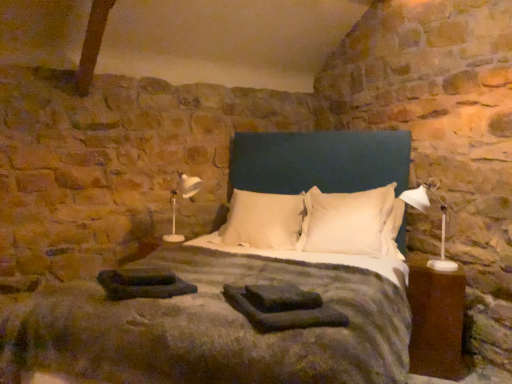
This screenshot has height=384, width=512. Identify the location of white soft pillow at center, which is counted as the 1th pillow, starting from the right. (352, 222).

The image size is (512, 384). Find the location of `brown wood nightstand at right`. brown wood nightstand at right is located at coordinates (436, 320).

The image size is (512, 384). Describe the element at coordinates (262, 221) in the screenshot. I see `white soft pillow at center, which is the second pillow from right to left` at that location.

What do you see at coordinates (240, 310) in the screenshot? This screenshot has width=512, height=384. I see `velvet blue bed at center` at bounding box center [240, 310].

From the picture: What is the approximate width of white plastic table lamp at left, which appears as the second table lamp when viewed from the right?

white plastic table lamp at left, which appears as the second table lamp when viewed from the right, is 54.87 centimeters in width.

In order to click on white plastic table lamp at right, the second table lamp when ordered from left to right in this screenshot , I will do `click(425, 212)`.

This screenshot has height=384, width=512. What do you see at coordinates (425, 212) in the screenshot? I see `white plastic table lamp at right, the second table lamp when ordered from left to right` at bounding box center [425, 212].

At what (x,y) coordinates should I click in order to perform the action: click on black fabric at lower left, the 1th material when ordered from left to right. Please return your answer as a coordinate pair (x, y). This screenshot has width=512, height=384. Looking at the image, I should click on click(x=143, y=284).

Find the location of a particular element. This screenshot has width=512, height=384. the 2nd table lamp behind when counting from the velvet blue bed at center is located at coordinates (189, 185).

Considering the positions of objects white plastic table lamp at left, the 2th table lamp from the front, and velvet blue bed at center in the image provided, who is more to the right, white plastic table lamp at left, the 2th table lamp from the front, or velvet blue bed at center?

velvet blue bed at center is more to the right.

Relative to velvet blue bed at center, is white plastic table lamp at left, which appears as the second table lamp when viewed from the right, in front or behind?

Visually, white plastic table lamp at left, which appears as the second table lamp when viewed from the right, is located behind velvet blue bed at center.

Which is more to the left, velvet blue bed at center or black fabric at lower left, placed as the 2th material when sorted from right to left?

Positioned to the left is black fabric at lower left, placed as the 2th material when sorted from right to left.

From a real-world perspective, is velvet blue bed at center positioned above or below black fabric at lower left, placed as the 2th material when sorted from right to left?

Clearly, from a real-world perspective, velvet blue bed at center is above black fabric at lower left, placed as the 2th material when sorted from right to left.

Is black fabric at lower left, placed as the 2th material when sorted from right to left, completely or partially inside velvet blue bed at center?

Indeed, black fabric at lower left, placed as the 2th material when sorted from right to left, is located within velvet blue bed at center.

Is velvet blue bed at center turned away from black fabric at lower left, placed as the 2th material when sorted from right to left?

No, velvet blue bed at center is not facing away from black fabric at lower left, placed as the 2th material when sorted from right to left.

Is point (254, 235) closer or farther from the camera than point (452, 262)?

Point (254, 235) appears to be farther away from the viewer than point (452, 262).

In the image, is white soft pillow at center, which appears as the 1th pillow when viewed from the left, positioned in front of or behind white plastic table lamp at right, which is the first table lamp from front to back?

Clearly, white soft pillow at center, which appears as the 1th pillow when viewed from the left, is behind white plastic table lamp at right, which is the first table lamp from front to back.

Between white soft pillow at center, which appears as the 1th pillow when viewed from the left, and white plastic table lamp at right, the second table lamp when ordered from left to right, which one has more height?

white plastic table lamp at right, the second table lamp when ordered from left to right, is taller.

In the scene shown: Is white soft pillow at center, which is the second pillow from right to left, oriented towards white plastic table lamp at right, the second table lamp when ordered from left to right?

No, white soft pillow at center, which is the second pillow from right to left, is not facing towards white plastic table lamp at right, the second table lamp when ordered from left to right.

Is white soft pillow at center, which is the second pillow from right to left, in front of or behind dark gray fabric at center, the 2th material viewed from the left, in the image?

In the image, white soft pillow at center, which is the second pillow from right to left, appears behind dark gray fabric at center, the 2th material viewed from the left.

Can you confirm if white soft pillow at center, which appears as the 1th pillow when viewed from the left, is smaller than dark gray fabric at center, arranged as the 1th material when viewed from the right?

Actually, white soft pillow at center, which appears as the 1th pillow when viewed from the left, might be larger than dark gray fabric at center, arranged as the 1th material when viewed from the right.

Does white soft pillow at center, which is the second pillow from right to left, have a lesser width compared to dark gray fabric at center, the 2th material viewed from the left?

Yes, white soft pillow at center, which is the second pillow from right to left, is thinner than dark gray fabric at center, the 2th material viewed from the left.

From a real-world perspective, is white soft pillow at center, which appears as the 1th pillow when viewed from the left, beneath dark gray fabric at center, arranged as the 1th material when viewed from the right?

No.

From a real-world perspective, is velvet blue bed at center positioned under white soft pillow at center, the second pillow in the left-to-right sequence, based on gravity?

Correct, in the physical world, velvet blue bed at center is lower than white soft pillow at center, the second pillow in the left-to-right sequence.

Is velvet blue bed at center taller or shorter than white soft pillow at center, which is counted as the 1th pillow, starting from the right?

velvet blue bed at center is taller than white soft pillow at center, which is counted as the 1th pillow, starting from the right.

Is velvet blue bed at center facing away from white soft pillow at center, which is counted as the 1th pillow, starting from the right?

Correct, velvet blue bed at center is looking away from white soft pillow at center, which is counted as the 1th pillow, starting from the right.

Who is taller, brown wood nightstand at right or white soft pillow at center, which appears as the 1th pillow when viewed from the left?

brown wood nightstand at right is taller.

From a real-world perspective, is brown wood nightstand at right on top of white soft pillow at center, which is the second pillow from right to left?

No, from a real-world perspective, brown wood nightstand at right is not above white soft pillow at center, which is the second pillow from right to left.

Can you tell me how much brown wood nightstand at right and white soft pillow at center, which appears as the 1th pillow when viewed from the left, differ in facing direction?

They differ by 2.4 degrees in their facing directions.

In the image, there is a white soft pillow at center, which appears as the 1th pillow when viewed from the left. In order to click on nightstand below it (from a real-world perspective) in this screenshot , I will do `click(436, 320)`.

Is black fabric at lower left, placed as the 2th material when sorted from right to left, wider or thinner than white plastic table lamp at right, which is the first table lamp from front to back?

Clearly, black fabric at lower left, placed as the 2th material when sorted from right to left, has more width compared to white plastic table lamp at right, which is the first table lamp from front to back.

Is the surface of black fabric at lower left, placed as the 2th material when sorted from right to left, in direct contact with white plastic table lamp at right, which is the first table lamp from front to back?

No, black fabric at lower left, placed as the 2th material when sorted from right to left, is not touching white plastic table lamp at right, which is the first table lamp from front to back.

From the image's perspective, which one is positioned higher, black fabric at lower left, the 1th material when ordered from left to right, or white plastic table lamp at right, arranged as the 1th table lamp when viewed from the right?

From the image's view, white plastic table lamp at right, arranged as the 1th table lamp when viewed from the right, is above.

Could you tell me if black fabric at lower left, the 1th material when ordered from left to right, is turned towards white plastic table lamp at right, arranged as the 1th table lamp when viewed from the right?

No, black fabric at lower left, the 1th material when ordered from left to right, is not facing towards white plastic table lamp at right, arranged as the 1th table lamp when viewed from the right.

Where is `the 1st table lamp positioned above the velvet blue bed at center (from a real-world perspective)`? This screenshot has width=512, height=384. the 1st table lamp positioned above the velvet blue bed at center (from a real-world perspective) is located at coordinates (189, 185).

Locate an element on the screen. the 1st material positioned below the velvet blue bed at center (from the image's perspective) is located at coordinates (143, 284).

Considering their positions, is white soft pillow at center, which is the second pillow from right to left, positioned further to brown wood nightstand at right than velvet blue bed at center?

The object further to brown wood nightstand at right is white soft pillow at center, which is the second pillow from right to left.

From the image, which object appears to be farther from white plastic table lamp at right, the second table lamp when ordered from left to right, white soft pillow at center, the second pillow in the left-to-right sequence, or velvet blue bed at center?

Based on the image, velvet blue bed at center appears to be further to white plastic table lamp at right, the second table lamp when ordered from left to right.

Considering their positions, is white soft pillow at center, which is counted as the 1th pillow, starting from the right, positioned further to white plastic table lamp at right, the second table lamp when ordered from left to right, than dark gray fabric at center, arranged as the 1th material when viewed from the right?

dark gray fabric at center, arranged as the 1th material when viewed from the right, is further to white plastic table lamp at right, the second table lamp when ordered from left to right.

From the picture: Estimate the real-world distances between objects in this image. Which object is closer to black fabric at lower left, the 1th material when ordered from left to right, brown wood nightstand at right or dark gray fabric at center, the 2th material viewed from the left?

dark gray fabric at center, the 2th material viewed from the left, is closer to black fabric at lower left, the 1th material when ordered from left to right.

Looking at the image, which one is located further to white plastic table lamp at right, which is the first table lamp from front to back, white soft pillow at center, the second pillow in the left-to-right sequence, or brown wood nightstand at right?

white soft pillow at center, the second pillow in the left-to-right sequence, is positioned further to the anchor white plastic table lamp at right, which is the first table lamp from front to back.

From the image, which object appears to be farther from white soft pillow at center, which is the second pillow from right to left, velvet blue bed at center or white soft pillow at center, the second pillow in the left-to-right sequence?

The object further to white soft pillow at center, which is the second pillow from right to left, is velvet blue bed at center.

Based on their spatial positions, is dark gray fabric at center, the 2th material viewed from the left, or black fabric at lower left, the 1th material when ordered from left to right, closer to white soft pillow at center, the second pillow in the left-to-right sequence?

The object closer to white soft pillow at center, the second pillow in the left-to-right sequence, is dark gray fabric at center, the 2th material viewed from the left.

Estimate the real-world distances between objects in this image. Which object is further from white soft pillow at center, which appears as the 1th pillow when viewed from the left, dark gray fabric at center, the 2th material viewed from the left, or white soft pillow at center, which is counted as the 1th pillow, starting from the right?

Based on the image, dark gray fabric at center, the 2th material viewed from the left, appears to be further to white soft pillow at center, which appears as the 1th pillow when viewed from the left.

Locate an element on the screen. pillow between black fabric at lower left, the 1th material when ordered from left to right, and white soft pillow at center, which appears as the 1th pillow when viewed from the left, along the z-axis is located at coordinates (352, 222).

The width and height of the screenshot is (512, 384). Identify the location of table lamp between black fabric at lower left, the 1th material when ordered from left to right, and brown wood nightstand at right. (425, 212).

I want to click on pillow between dark gray fabric at center, arranged as the 1th material when viewed from the right, and white plastic table lamp at left, acting as the first table lamp starting from the left, along the z-axis, so click(x=352, y=222).

Identify the location of material positioned between dark gray fabric at center, arranged as the 1th material when viewed from the right, and white soft pillow at center, which is counted as the 1th pillow, starting from the right, from near to far. (143, 284).